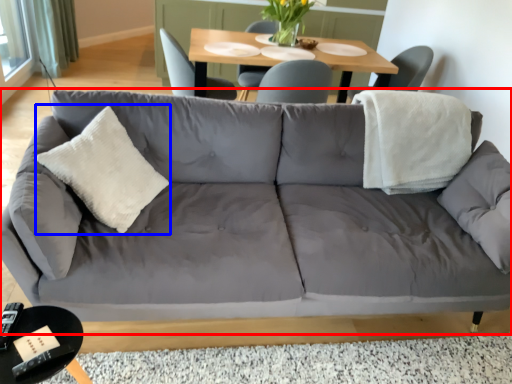
Question: Among these objects, which one is farthest to the camera, studio couch (highlighted by a red box) or throw pillow (highlighted by a blue box)?

Choices:
 (A) studio couch
 (B) throw pillow

Answer: (B)